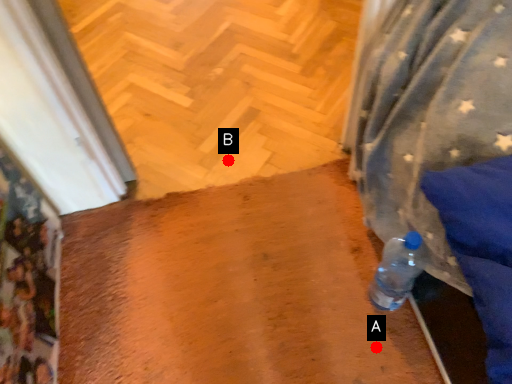
Question: Two points are circled on the image, labeled by A and B beside each circle. Which point is closer to the camera?

Choices:
 (A) A is closer
 (B) B is closer

Answer: (A)